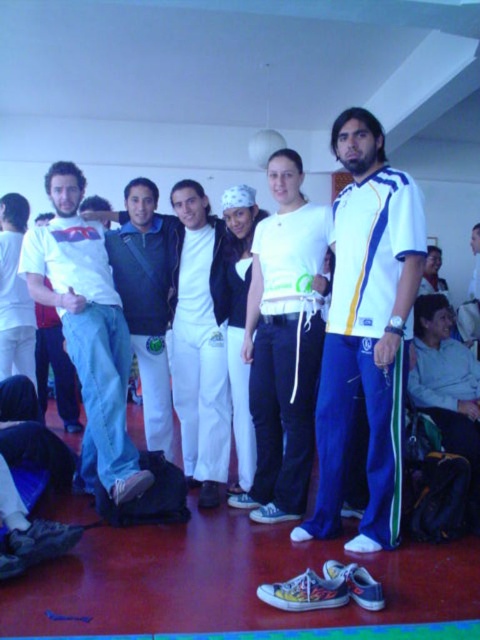
You are standing at the back of the gymnasium and want to pick up your shoes. There are two pairs of sneakers on the floor labeled as point (396,314) and point (110,484). Which pair is closer to you?

Point (110,484) is further back than point (396,314), so the pair at point (110,484) is closer to you since it is further back from the camera and you are at the back.